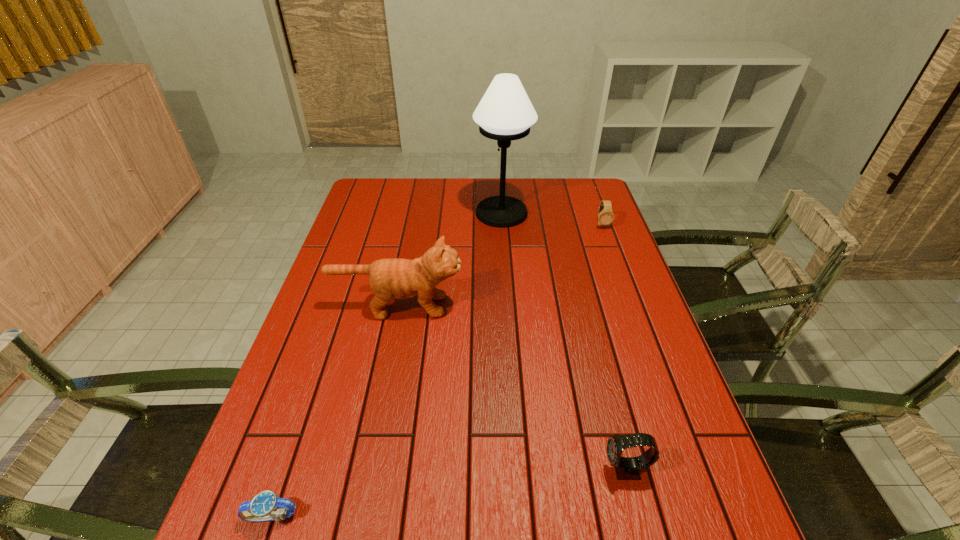
This screenshot has height=540, width=960. I want to click on free space that satisfies the following two spatial constraints: 1. on the front side of the table lamp; 2. on the face of the second tallest object, so click(x=508, y=306).

Locate an element on the screen. The width and height of the screenshot is (960, 540). free space that satisfies the following two spatial constraints: 1. on the face of the farthest watch; 2. on the face of the tallest watch is located at coordinates (692, 470).

Find the location of a particular element. This screenshot has height=540, width=960. vacant area that satisfies the following two spatial constraints: 1. on the back side of the tallest object; 2. on the right side of the leftmost watch is located at coordinates (373, 213).

Identify the location of vacant space that satisfies the following two spatial constraints: 1. on the face of the second tallest watch; 2. on the face of the second object from right to left. 692,470.